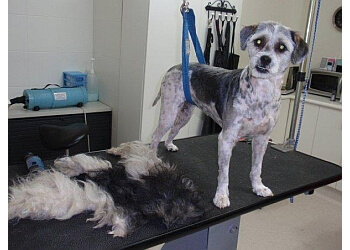
You are a GUI agent. You are given a task and a screenshot of the screen. Output one action in this format:
    pyautogui.click(x=<x>, y=<y>)
    Task: Click on the hook
    This screenshot has width=350, height=250.
    Given the screenshot: What is the action you would take?
    pyautogui.click(x=207, y=14), pyautogui.click(x=211, y=17), pyautogui.click(x=215, y=13), pyautogui.click(x=218, y=15), pyautogui.click(x=220, y=18), pyautogui.click(x=225, y=16), pyautogui.click(x=230, y=16), pyautogui.click(x=231, y=20), pyautogui.click(x=236, y=17)